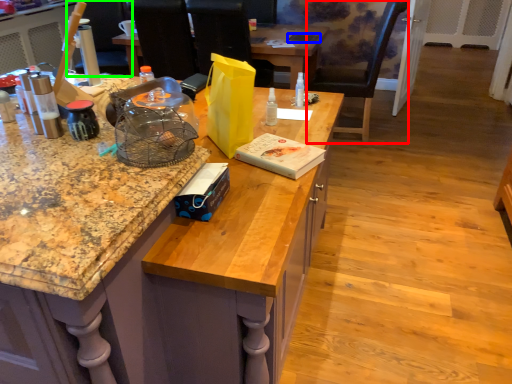
Question: Based on their relative distances, which object is nearer to chair (highlighted by a red box)? Choose from laptop (highlighted by a blue box) and armchair (highlighted by a green box).

Choices:
 (A) laptop
 (B) armchair

Answer: (A)